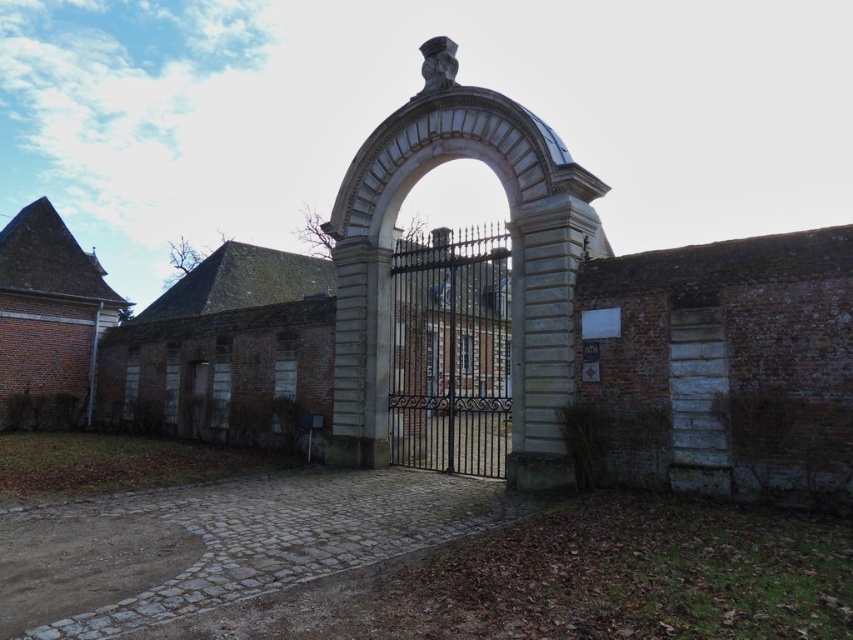
You are standing at the entrance of the grand estate and want to take a photo of the white stone archway at center. If you are positioned at the coordinates where the cobblestone path begins, which direction should you face to capture the archway in your shot?

Since the white stone archway at center is located at point (511, 260), you should face towards the coordinates where the archway is positioned to capture it in your photo.

From the picture: You are standing in front of the grand entrance gate. You need to pass through the black wrought iron gate at center to enter the estate. However, you notice the white stone archway at center. Is the archway positioned to the left or right of the gate?

The white stone archway at center is to the left of the black wrought iron gate at center.

Based on the photo, you are standing at the entrance of the historic estate and see two points marked on the ground. The first point is at coordinate point (444, 60) and the second is at point (198, 429). Which point is closer to you as you face the closed wrought iron gate?

Point (444, 60) is in front of point (198, 429), so it is closer to you when facing the closed wrought iron gate.